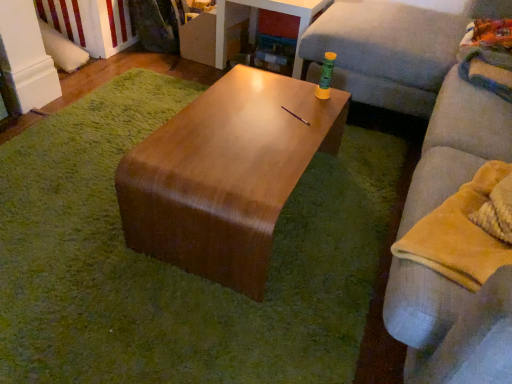
Identify the location of vacant space to the left of shiny brown coffee table at center. The width and height of the screenshot is (512, 384). (78, 175).